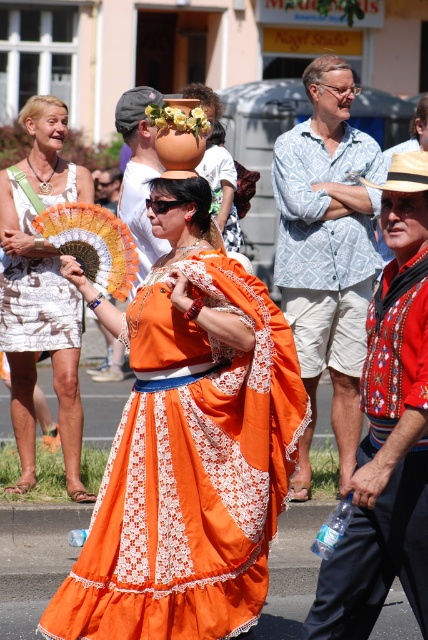
Question: Is orange fabric dress at center positioned in front of embroidered cotton robe at center?

Choices:
 (A) no
 (B) yes

Answer: (A)

Question: Considering the relative positions of light blue patterned shirt at center and matte white hat at center in the image provided, where is light blue patterned shirt at center located with respect to matte white hat at center?

Choices:
 (A) right
 (B) left

Answer: (A)

Question: Which object is the closest to the light blue patterned shirt at center?

Choices:
 (A) white lace dress at left
 (B) orange fabric dress at center
 (C) matte white hat at center
 (D) white printed fabric dress at left

Answer: (C)

Question: Which object is closer to the camera taking this photo?

Choices:
 (A) orange fabric dress at center
 (B) white lace dress at left
 (C) white printed fabric dress at left

Answer: (A)

Question: Does white lace dress at left have a larger size compared to white printed fabric dress at left?

Choices:
 (A) no
 (B) yes

Answer: (B)

Question: Which point is farther to the camera?

Choices:
 (A) (318, 272)
 (B) (56, 305)
 (C) (14, 348)
 (D) (127, 168)

Answer: (D)